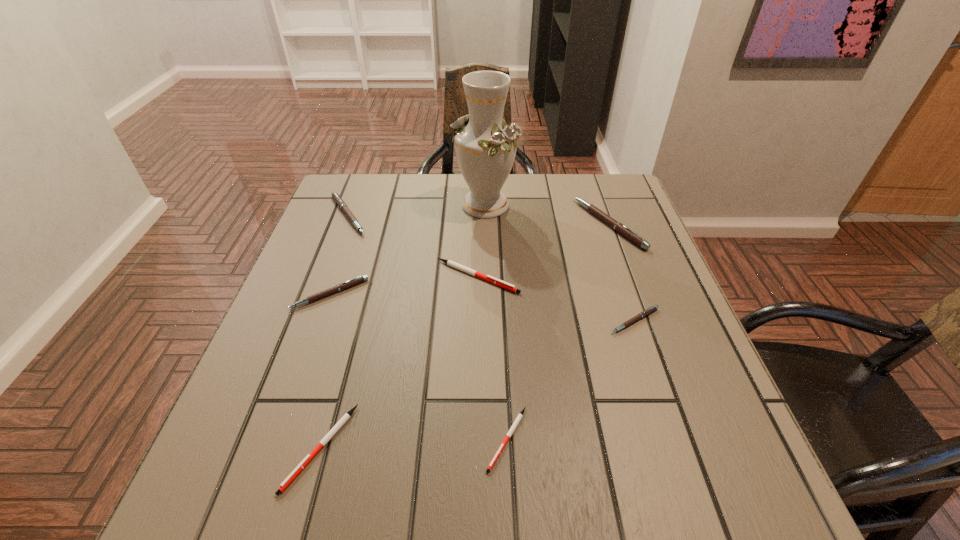
You are a GUI agent. You are given a task and a screenshot of the screen. Output one action in this format:
    pyautogui.click(x=<x>, y=<y>)
    Task: Click on the object that is the fourth closest to the second smallest pink pen
    This screenshot has height=540, width=960.
    Given the screenshot: What is the action you would take?
    pyautogui.click(x=485, y=146)

Locate an element on the screen. object that is the fifth closest to the vase is located at coordinates pos(646,312).

Find the location of a particular element. The image size is (960, 540). the closest pen relative to the second biggest white pen is located at coordinates (520, 415).

At what (x,y) coordinates should I click in order to perform the action: click on pen that stands as the fifth closest to the smallest pink pen. Please return your answer as a coordinate pair (x, y). The height and width of the screenshot is (540, 960). Looking at the image, I should click on (360, 279).

In order to click on pink pen that stands as the third closest to the smallest pink pen in this screenshot , I will do `click(336, 197)`.

Identify which pink pen is the third nearest to the seventh shortest object. Please provide its 2D coordinates. Your answer should be formatted as a tuple, i.e. [(x, y)], where the tuple contains the x and y coordinates of a point satisfying the conditions above.

[(336, 197)]

This screenshot has height=540, width=960. In order to click on the closest white pen relative to the second biggest white pen in this screenshot , I will do `click(520, 415)`.

Point out which white pen is positioned as the nearest to the smallest pink pen. Please provide its 2D coordinates. Your answer should be formatted as a tuple, i.e. [(x, y)], where the tuple contains the x and y coordinates of a point satisfying the conditions above.

[(470, 271)]